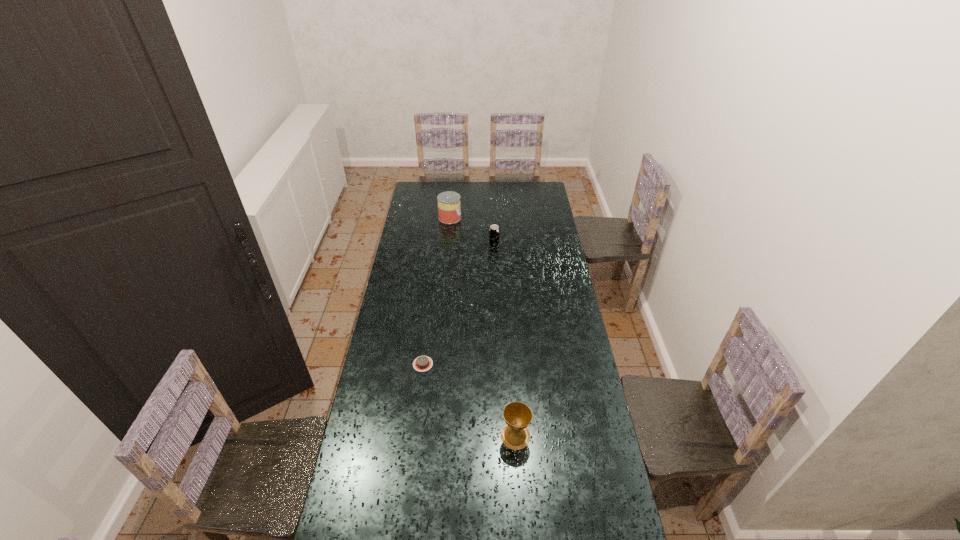
Find the location of a particular element. The width and height of the screenshot is (960, 540). free space that is in between the chalice and the chocolate cake is located at coordinates (469, 400).

I want to click on vacant space that's between the chalice and the soda can, so click(505, 341).

Where is `vacant area that lies between the nearest object and the farthest object`? This screenshot has height=540, width=960. vacant area that lies between the nearest object and the farthest object is located at coordinates (483, 327).

At what (x,y) coordinates should I click in order to perform the action: click on object that is the third closest to the nearest object. Please return your answer as a coordinate pair (x, y). Image resolution: width=960 pixels, height=540 pixels. Looking at the image, I should click on (449, 207).

The height and width of the screenshot is (540, 960). I want to click on object that is the third closest one to the chalice, so click(x=449, y=207).

At what (x,y) coordinates should I click in order to perform the action: click on vacant region that satisfies the following two spatial constraints: 1. on the back side of the shortest object; 2. on the left side of the can. Please return your answer as a coordinate pair (x, y). Image resolution: width=960 pixels, height=540 pixels. Looking at the image, I should click on (441, 218).

Find the location of a particular element. Image resolution: width=960 pixels, height=540 pixels. free space that satisfies the following two spatial constraints: 1. on the front side of the farthest object; 2. on the left side of the second farthest object is located at coordinates (447, 246).